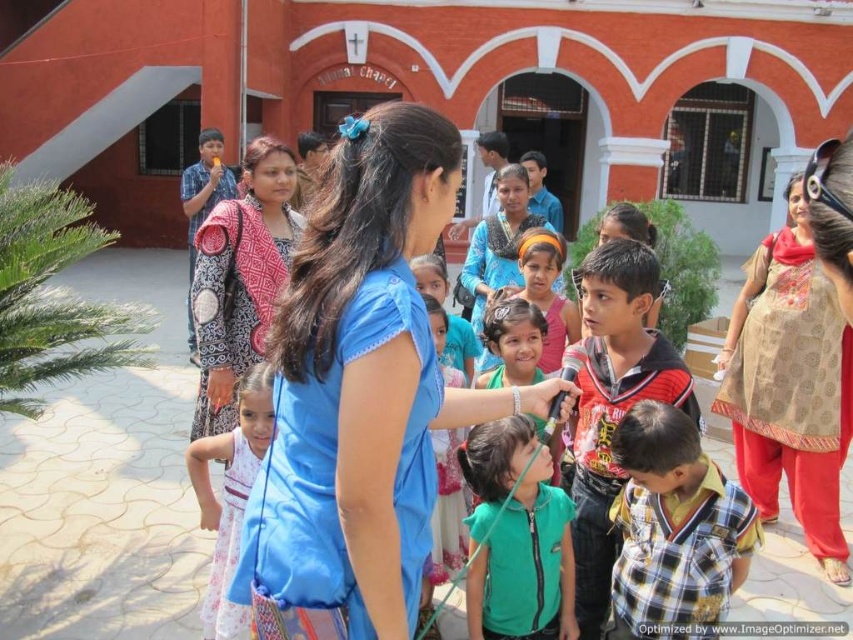
You are organizing a small event in the courtyard and need to place a 10 feet long table between the beige patterned kurta at center and the white printed dress at center. Is there enough space between them to accommodate the table?

The distance between the beige patterned kurta at center and the white printed dress at center is 44.42 feet, which is more than enough to place a 10 feet long table between them.

You are a photographer trying to capture both the beige patterned kurta at center and the white printed dress at center in the same frame. Considering their heights, which one might you position closer to the camera to ensure both are fully visible?

The beige patterned kurta at center is taller than the white printed dress at center. To ensure both are fully visible, position the beige patterned kurta at center closer to the camera so its height doesn not block the view of the white printed dress at center.